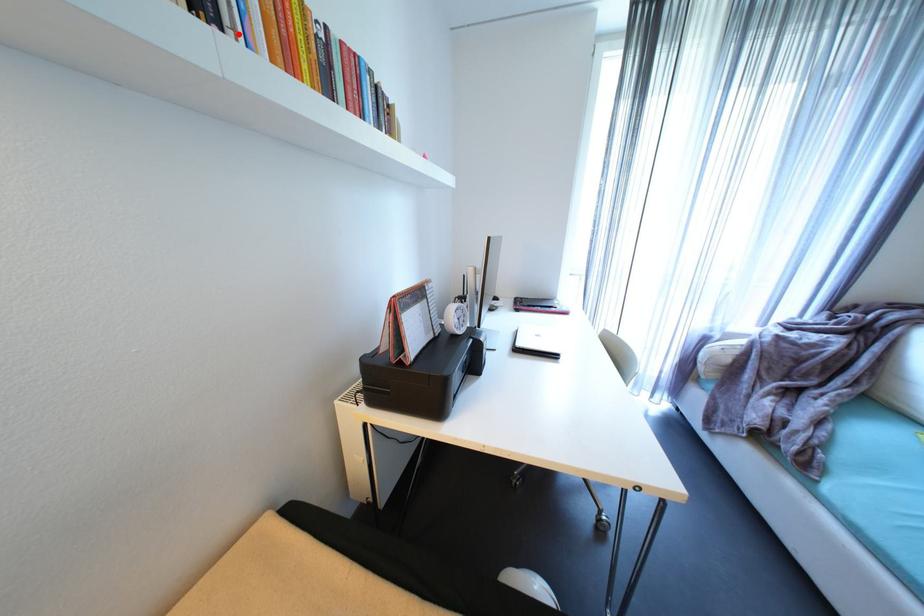
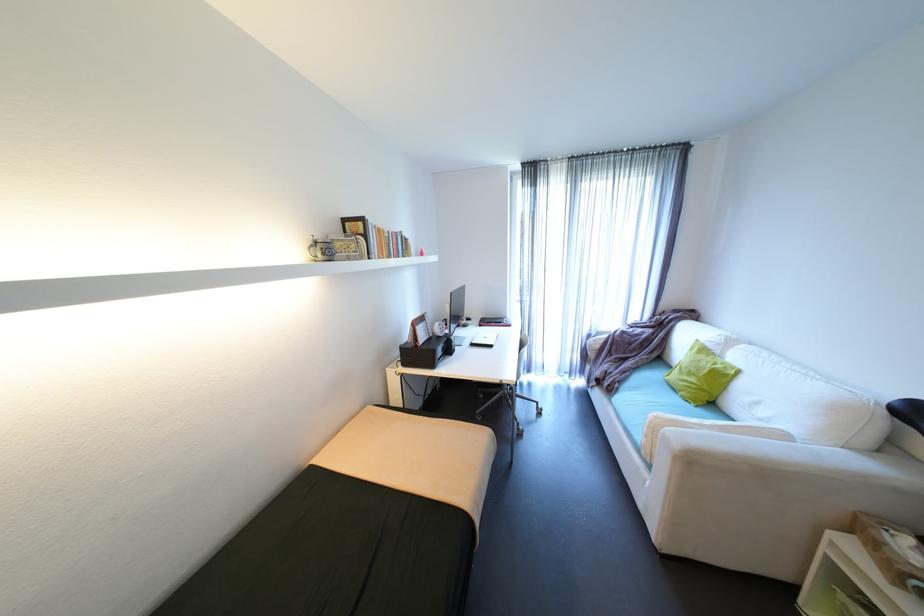
In the second image, find the point that corresponds to the highlighted location in the first image.

(380, 254)